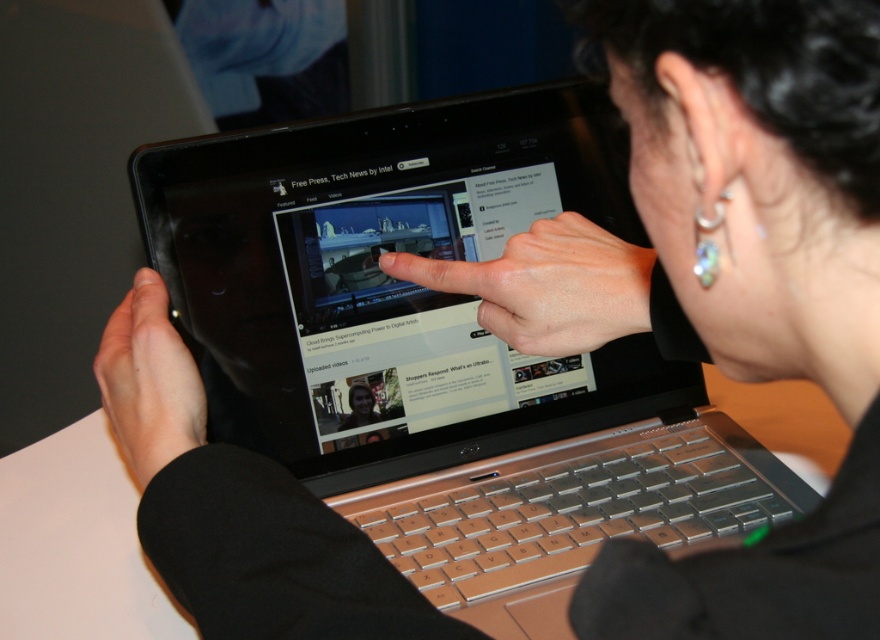
You are a graphic designer working on a project that requires precise measurements. You need to ensure that the matte black finger at center does not exceed the width of the matte black screen at center. Based on the scene, is this requirement met?

The matte black screen at center has a greater width than the matte black finger at center, so the requirement is met as the finger does not exceed the screen width.

You are a graphic designer who needs to ensure your laptop screen is large enough to view detailed designs. You have a silver metallic laptop at center and a matte black screen at center. Which object has a larger height for viewing purposes?

The silver metallic laptop at center is much taller than the matte black screen at center, making it the better option for viewing detailed designs due to its greater height.

You are a graphic designer working on a project that requires precise measurements. You need to ensure that the silver metallic laptop at center can fit within a design template that accommodates objects no wider than the matte black finger at center. Based on the scene, will the laptop fit? Explain your reasoning.

The silver metallic laptop at center is wider than the matte black finger at center. Since the laptop exceeds the maximum width allowed by the template, it will not fit within the specified dimensions.